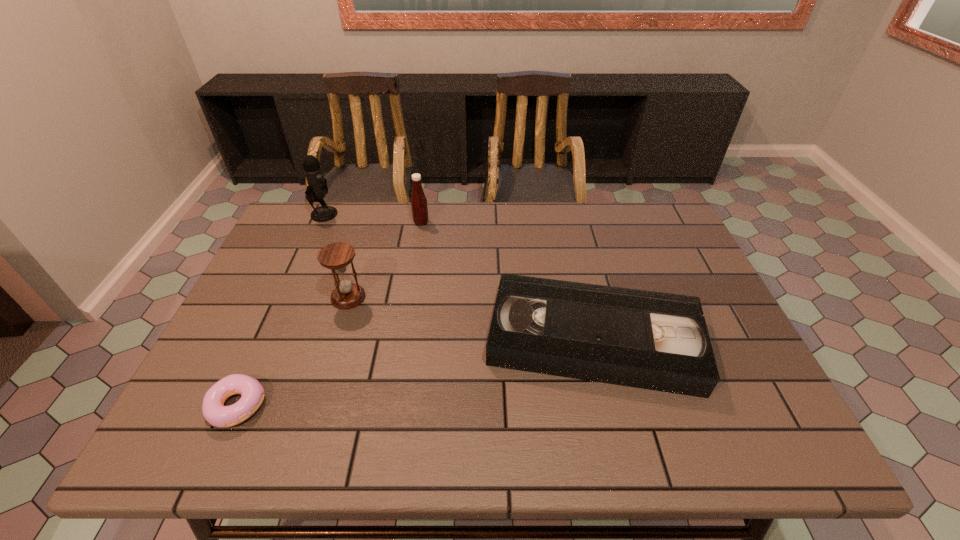
The width and height of the screenshot is (960, 540). Identify the location of free space at the near edge of the desktop. (294, 454).

Locate an element on the screen. The image size is (960, 540). free space at the left edge of the desktop is located at coordinates (236, 360).

Identify the location of free space at the right edge. (661, 249).

In the image, there is a desktop. Where is `free region at the near left corner`? free region at the near left corner is located at coordinates (204, 422).

Where is `free space at the far right corner of the desktop`? free space at the far right corner of the desktop is located at coordinates (636, 214).

The height and width of the screenshot is (540, 960). In order to click on blank area at the near right corner in this screenshot , I will do `click(774, 453)`.

Identify the location of vacant point located between the Tabasco sauce and the hourglass. This screenshot has width=960, height=540. (385, 260).

At what (x,y) coordinates should I click in order to perform the action: click on vacant area that lies between the tallest object and the Tabasco sauce. Please return your answer as a coordinate pair (x, y). Looking at the image, I should click on (372, 218).

Locate an element on the screen. This screenshot has height=540, width=960. free space between the tallest object and the rightmost object is located at coordinates (459, 277).

Where is `vacant space that's between the rightmost object and the third object from left to right`? vacant space that's between the rightmost object and the third object from left to right is located at coordinates [470, 319].